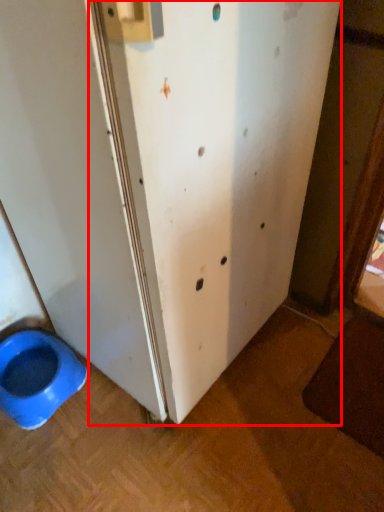
Question: From the image's perspective, what is the correct spatial positioning of screen door (annotated by the red box) in reference to toilet?

Choices:
 (A) above
 (B) below

Answer: (A)